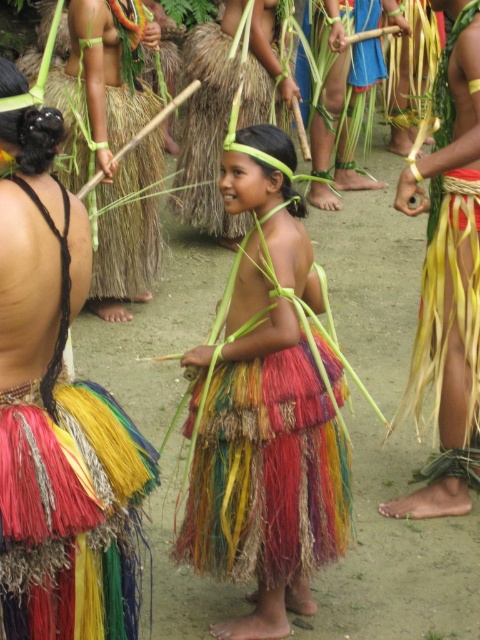
Question: Which of the following is the closest to the observer?

Choices:
 (A) (239, 232)
 (B) (210, 483)

Answer: (B)

Question: Does multicolored grass skirt at center have a greater width compared to multicolored woven skirt at center?

Choices:
 (A) no
 (B) yes

Answer: (A)

Question: Which of the following is the closest to the observer?

Choices:
 (A) (326, 428)
 (B) (193, 125)

Answer: (A)

Question: Does multicolored grass skirt at center lie in front of multicolored woven skirt at center?

Choices:
 (A) yes
 (B) no

Answer: (A)

Question: Can you confirm if multicolored grass skirt at center is positioned above multicolored woven skirt at center?

Choices:
 (A) no
 (B) yes

Answer: (A)

Question: Which of the following is the farthest from the observer?

Choices:
 (A) (313, 307)
 (B) (216, 67)

Answer: (B)